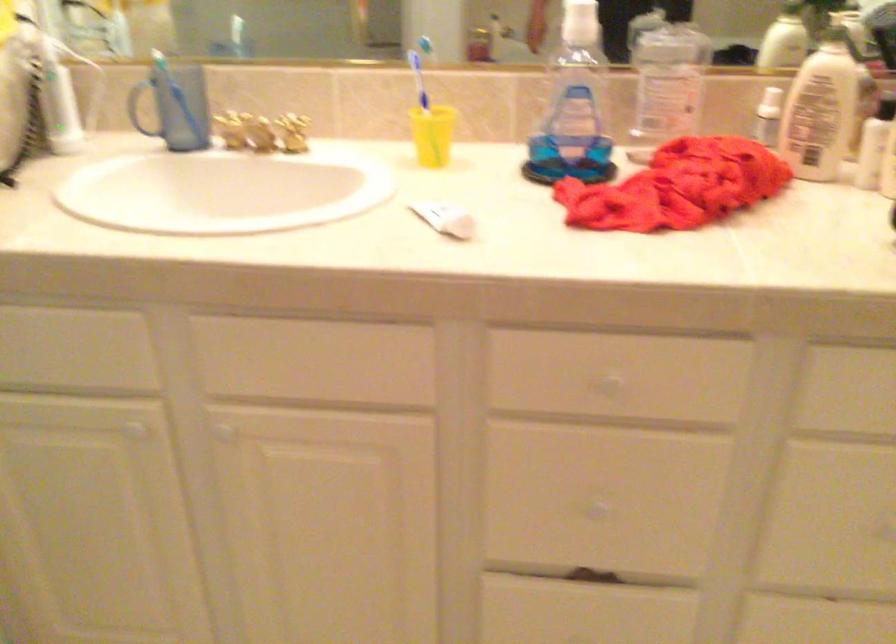
Where would you push the spray bottle nozzle? Please return your answer as a coordinate pair (x, y).

(39, 41)